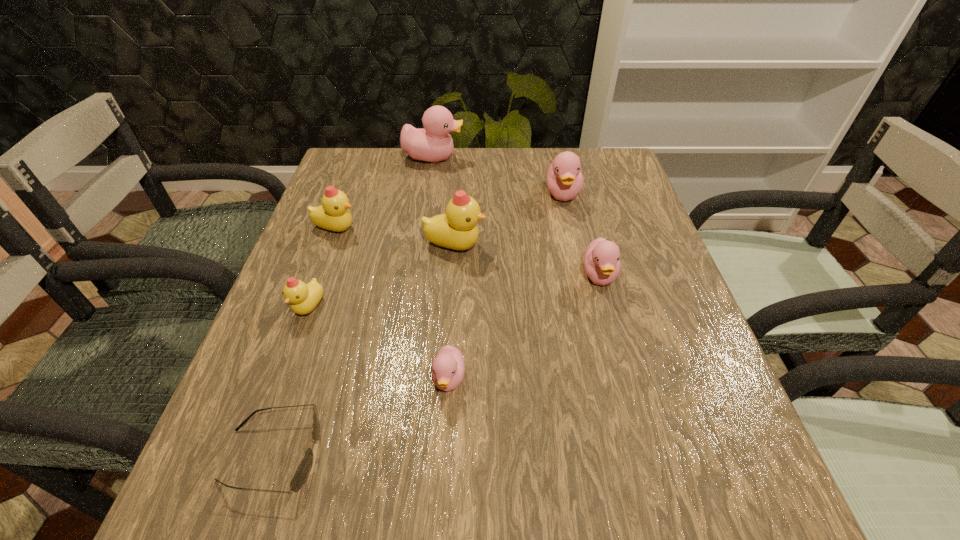
The width and height of the screenshot is (960, 540). I want to click on vacant area at the near right corner, so click(765, 515).

Find the location of a particular element. The height and width of the screenshot is (540, 960). free spot between the shortest object and the smallest pink duckling is located at coordinates (361, 417).

Locate an element on the screen. The width and height of the screenshot is (960, 540). vacant point located between the sixth nearest duckling and the shortest duckling is located at coordinates (506, 287).

Locate an element on the screen. The image size is (960, 540). vacant region between the second farthest duckling and the shortest object is located at coordinates (418, 325).

I want to click on free area in between the second biggest yellow duckling and the biggest yellow duckling, so click(396, 237).

The height and width of the screenshot is (540, 960). In order to click on free space between the second farthest pink duckling and the nearest yellow duckling in this screenshot , I will do `click(436, 251)`.

Where is `free spot between the shortest object and the biggest pink duckling`? The image size is (960, 540). free spot between the shortest object and the biggest pink duckling is located at coordinates (352, 306).

The height and width of the screenshot is (540, 960). I want to click on vacant area that lies between the nearest yellow duckling and the seventh tallest object, so click(x=379, y=343).

In order to click on empty location between the shortest object and the third smallest pink duckling in this screenshot , I will do `click(418, 325)`.

Identify the location of object that ranks as the sixth closest to the farthest duckling. coord(448,367).